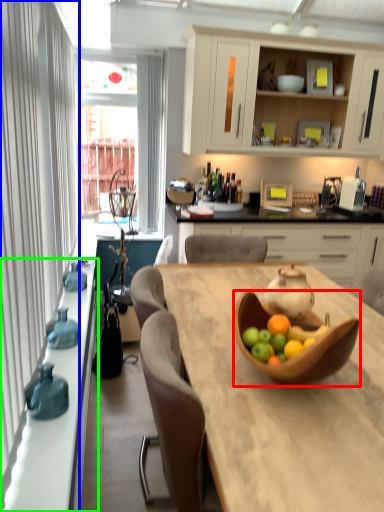
Question: Estimate the real-world distances between objects in this image. Which object is farther from tableware (highlighted by a red box), curtain (highlighted by a blue box) or countertop (highlighted by a green box)?

Choices:
 (A) curtain
 (B) countertop

Answer: (A)